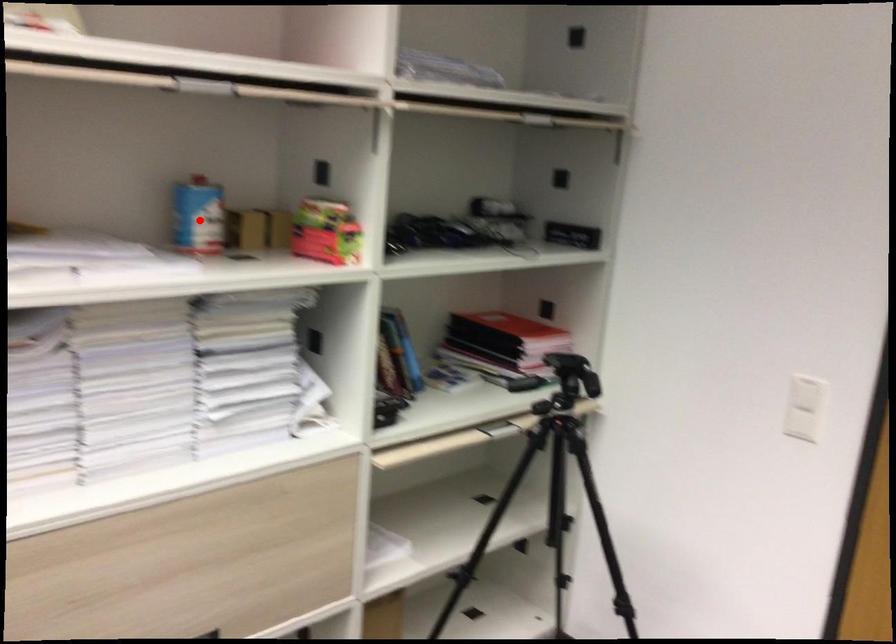
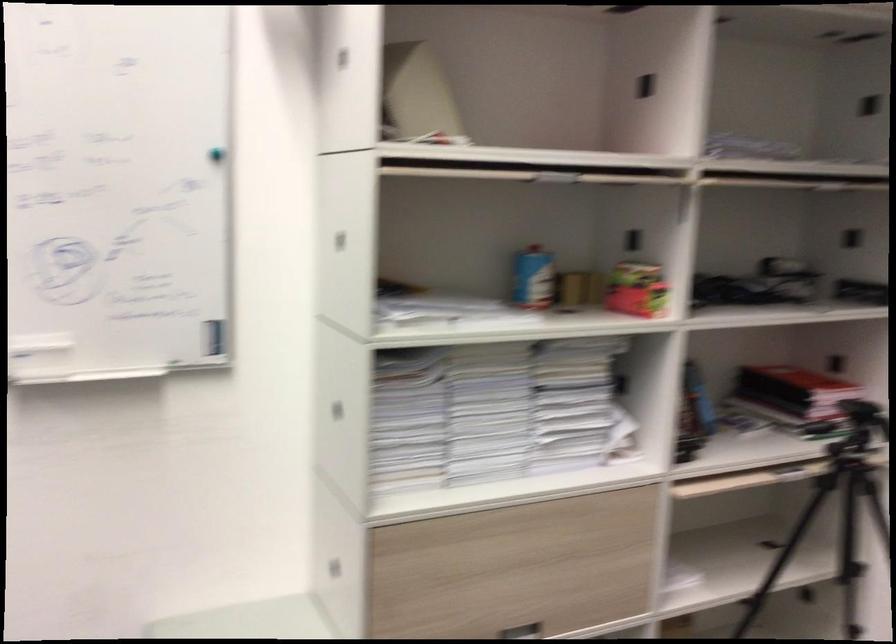
Question: I am providing you with two images of the same scene from different viewpoints. A red point is marked on the first image. At the location where the point appears in image 1, is it still visible in image 2?

Choices:
 (A) Yes
 (B) No

Answer: (A)